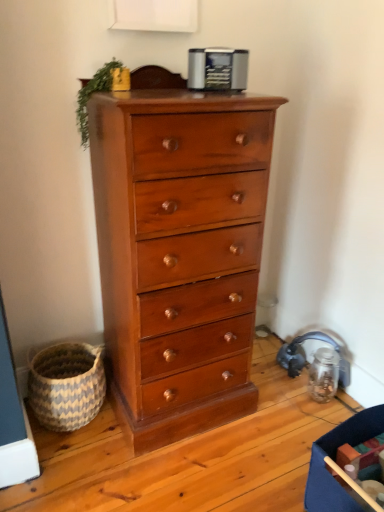
Question: Does point (218, 54) appear closer or farther from the camera than point (77, 389)?

Choices:
 (A) farther
 (B) closer

Answer: (B)

Question: Considering the positions of metallic silver toaster at upper center and blue and white woven basket at lower left in the image, is metallic silver toaster at upper center taller or shorter than blue and white woven basket at lower left?

Choices:
 (A) short
 (B) tall

Answer: (A)

Question: Which is nearer to the blue fabric storage box at lower right?

Choices:
 (A) green leafy plant at top left
 (B) shiny brown wood chest of drawers at center
 (C) metallic silver toaster at upper center
 (D) blue and white woven basket at lower left

Answer: (B)

Question: Which object is the farthest from the shiny brown wood chest of drawers at center?

Choices:
 (A) metallic silver toaster at upper center
 (B) blue and white woven basket at lower left
 (C) green leafy plant at top left
 (D) blue fabric storage box at lower right

Answer: (D)